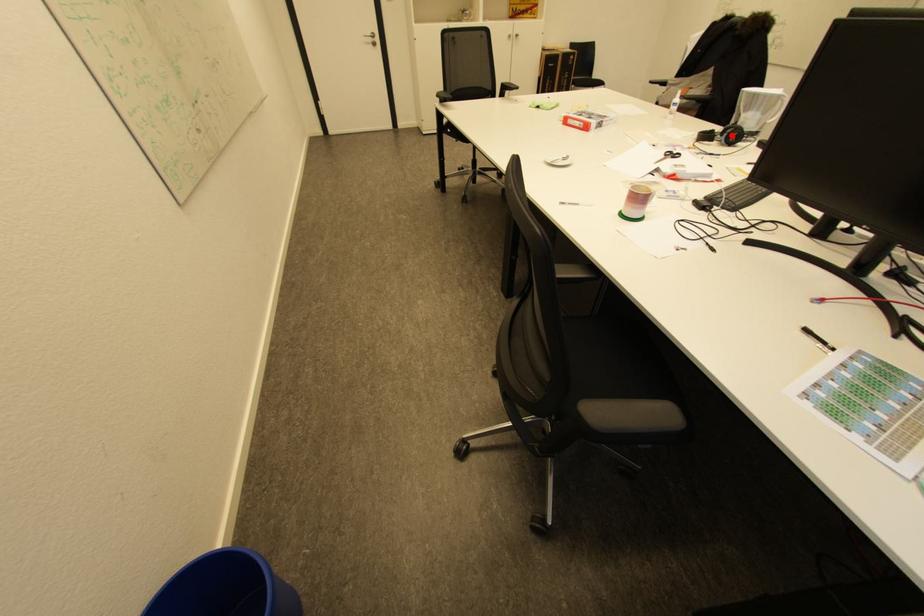
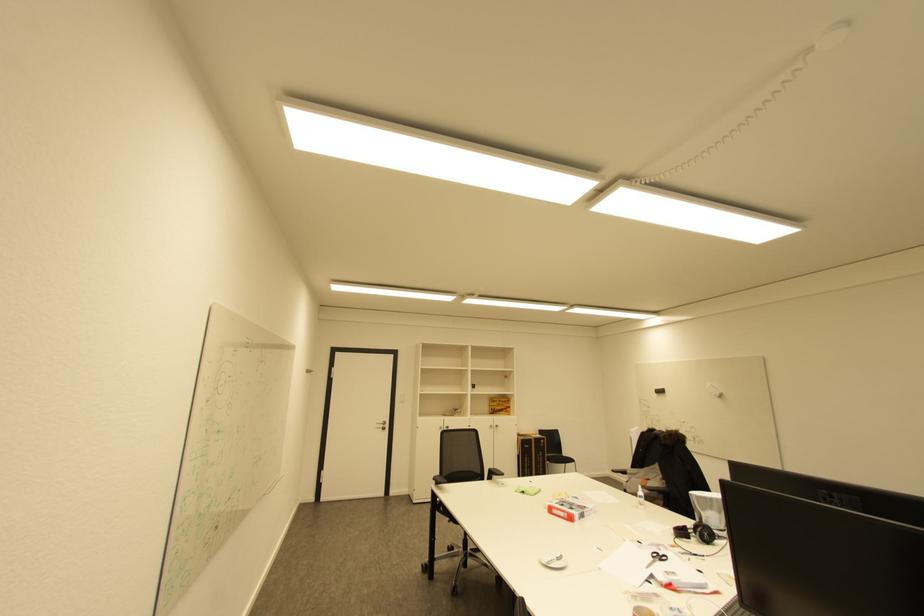
Where in the second image is the point corresponding to the highlighted location from the first image?

(704, 533)